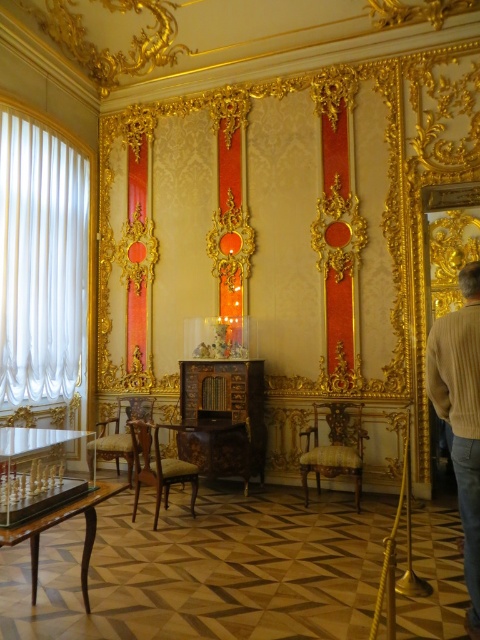
Question: Does light brown sweater at right lie behind gold/gilded mirror at right?

Choices:
 (A) yes
 (B) no

Answer: (B)

Question: Based on their relative distances, which object is nearer to the white sheer curtain at left?

Choices:
 (A) wooden polished chair at center
 (B) gold/gilded mirror at right
 (C) light brown wood chair at center
 (D) gold upholstered chair at center

Answer: (C)

Question: Which object is closer to the camera taking this photo?

Choices:
 (A) light brown wood chair at center
 (B) light brown sweater at right
 (C) wooden cabinet at center
 (D) wooden polished chair at center

Answer: (B)

Question: Is white sheer curtain at left smaller than wooden polished chair at center?

Choices:
 (A) yes
 (B) no

Answer: (B)

Question: Which of the following is the farthest from the observer?

Choices:
 (A) (477, 371)
 (B) (247, 417)

Answer: (B)

Question: In this image, where is light brown sweater at right located relative to gold/gilded mirror at right?

Choices:
 (A) left
 (B) right

Answer: (A)